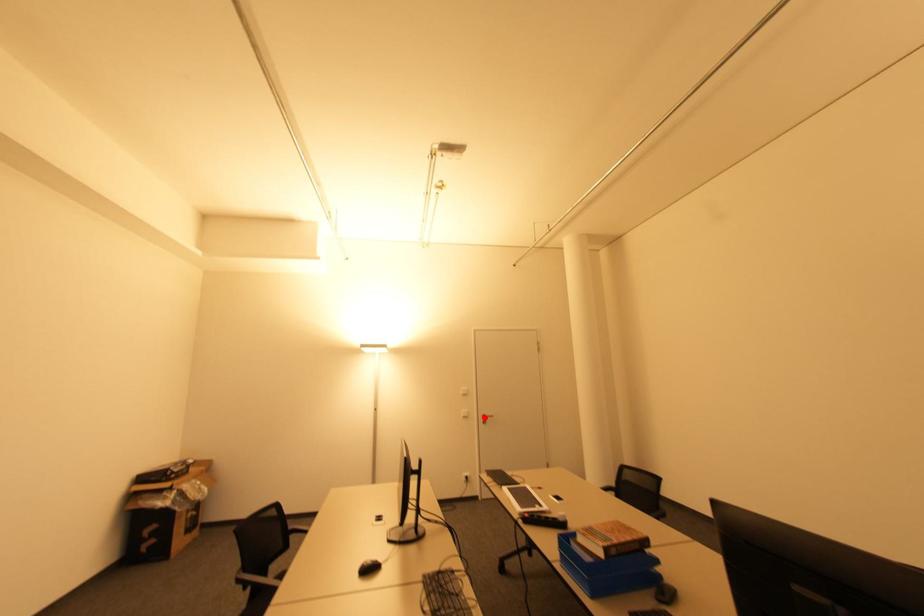
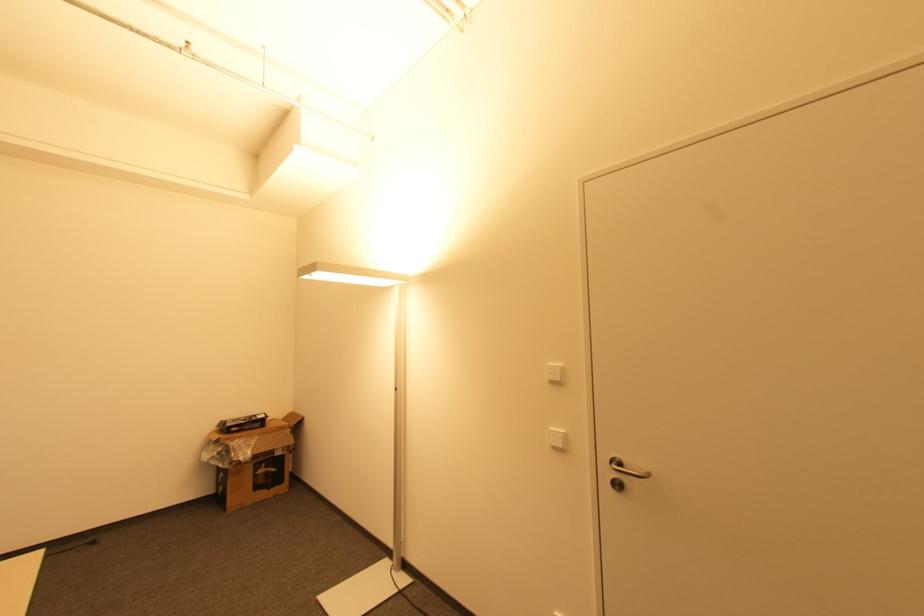
In the second image, find the point that corresponds to the highlighted location in the first image.

(613, 469)